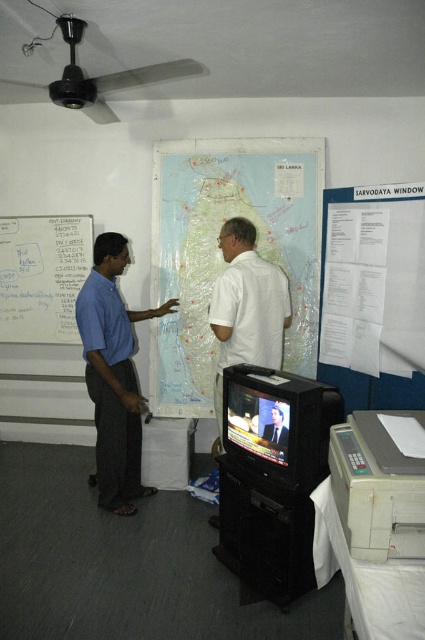
Between transparent plastic map at center and smooth white shirt at center, which one appears on the left side from the viewer's perspective?

transparent plastic map at center is more to the left.

Does point (280, 250) come behind point (274, 422)?

Yes, it is behind point (274, 422).

Is point (152, 348) farther from viewer compared to point (265, 428)?

Yes.

Identify the location of transparent plastic map at center. Image resolution: width=425 pixels, height=640 pixels. (221, 253).

Does blue cotton shirt at left appear under smooth white shirt at center?

No, blue cotton shirt at left is not below smooth white shirt at center.

Is blue cotton shirt at left positioned in front of smooth white shirt at center?

No, it is not.

Does point (130, 392) lie behind point (277, 435)?

Yes, it is.

The height and width of the screenshot is (640, 425). What are the coordinates of `blue cotton shirt at left` in the screenshot? It's located at (113, 376).

Which is above, whiteboard at left or smooth white shirt at center?

whiteboard at left

Between whiteboard at left and smooth white shirt at center, which one has more height?

Standing taller between the two is whiteboard at left.

Find the location of a particular element. The height and width of the screenshot is (640, 425). whiteboard at left is located at coordinates (42, 276).

Where is `whiteboard at left`? whiteboard at left is located at coordinates (42, 276).